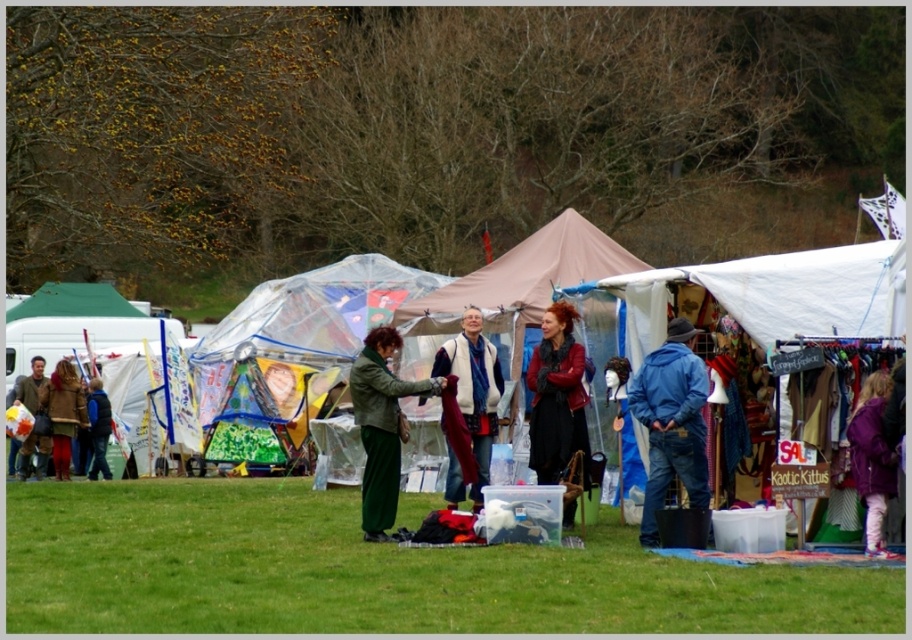
Question: Can you confirm if green matte jacket at center is bigger than matte brown jacket at left?

Choices:
 (A) yes
 (B) no

Answer: (A)

Question: Which object is positioned farthest from the blue denim jacket at center?

Choices:
 (A) transparent plastic dome at center
 (B) matte black jacket at center
 (C) matte red jacket at center

Answer: (B)

Question: Does matte brown coat at lower left appear on the left side of matte black jacket at center?

Choices:
 (A) yes
 (B) no

Answer: (A)

Question: Where is white fleece vest at center located in relation to matte brown coat at lower left in the image?

Choices:
 (A) below
 (B) above

Answer: (B)

Question: Which point is closer to the camera taking this photo?

Choices:
 (A) (557, 452)
 (B) (376, 417)
 (C) (333, 276)

Answer: (B)

Question: Which of the following is the closest to the observer?

Choices:
 (A) (98, 412)
 (B) (47, 392)
 (C) (392, 508)

Answer: (C)